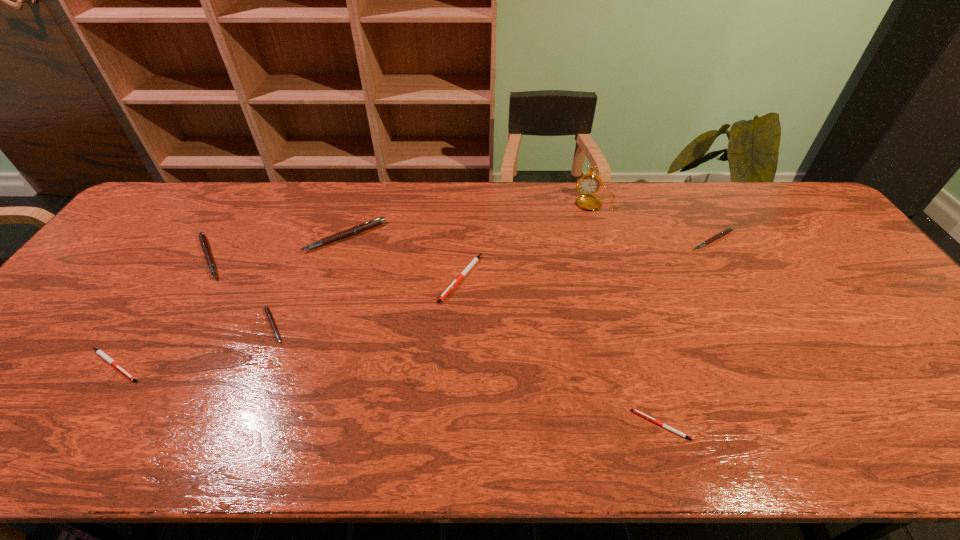
The image size is (960, 540). What are the coordinates of `vacant region at the near edge of the desktop` in the screenshot? It's located at (751, 437).

The width and height of the screenshot is (960, 540). Identify the location of vacant area at the left edge of the desktop. (166, 236).

This screenshot has height=540, width=960. I want to click on blank area at the right edge, so click(x=834, y=234).

This screenshot has height=540, width=960. In the image, there is a desktop. Find the location of `free space at the far right corner`. free space at the far right corner is located at coordinates (809, 225).

This screenshot has width=960, height=540. I want to click on free space between the second biggest pink pen and the second white pen from left to right, so click(x=335, y=267).

At what (x,y) coordinates should I click in order to perform the action: click on free spot between the third smallest pink pen and the fourth object from right to left. Please return your answer as a coordinate pair (x, y). The height and width of the screenshot is (540, 960). Looking at the image, I should click on (335, 267).

Where is `unoccupied position between the second white pen from right to left and the second tallest pen`? unoccupied position between the second white pen from right to left and the second tallest pen is located at coordinates (335, 267).

Find the location of a particular element. free point between the shortest pen and the nearest pink pen is located at coordinates (468, 375).

The width and height of the screenshot is (960, 540). Identify the location of vacant space in between the third tallest object and the nearest pen. (435, 341).

Where is `vacant area that lies between the second tallest object and the biggest white pen`? vacant area that lies between the second tallest object and the biggest white pen is located at coordinates (403, 257).